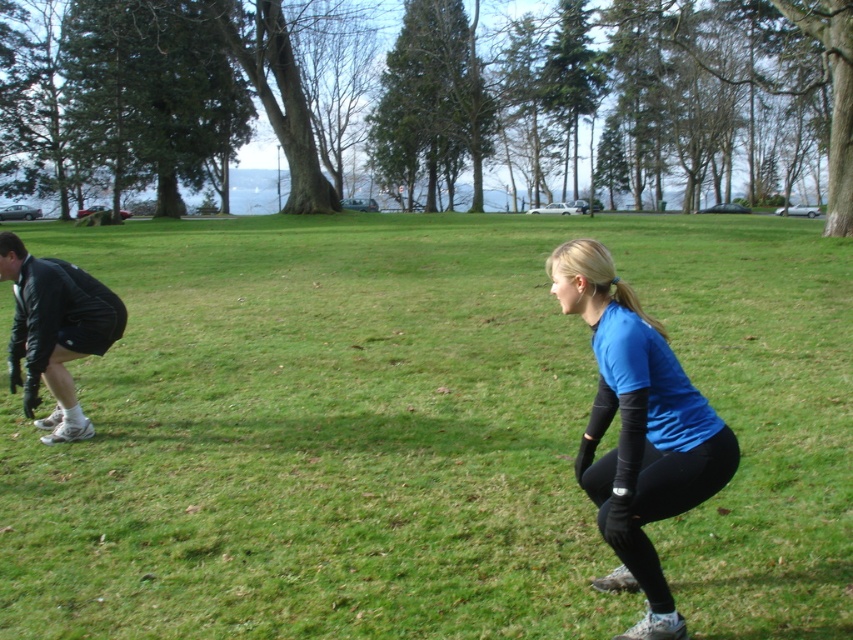
In the scene shown: You are a photographer trying to capture the perfect shot of the blue fabric at center and the blue fabric shirt at center. Which object should you focus on first if you want to ensure both are in sharp focus?

The blue fabric at center is located above the blue fabric shirt at center. Since the blue fabric shirt at center is lower, you should focus on the lower one first to ensure both are in focus.

Where is the blue fabric shirt at center located in the image?

The blue fabric shirt at center is located at point (637,429) in the image.

You are a photographer trying to capture a candid shot of the blue fabric shirt at center and the black leather jacket at lower left. Since you want both subjects in focus, which one should you focus on first to ensure proper depth of field?

The blue fabric shirt at center is located below the black leather jacket at lower left, so focusing on the black leather jacket at lower left first will ensure both are in focus as it is closer to the camera.